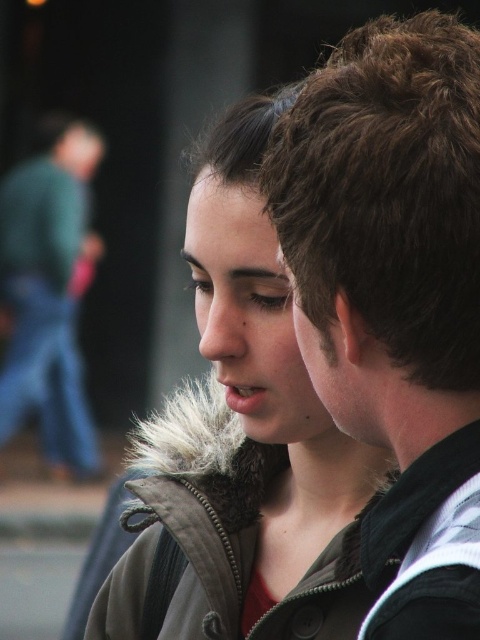
Question: Does brown hair at upper right appear on the right side of green denim jeans at left?

Choices:
 (A) yes
 (B) no

Answer: (A)

Question: Which point is farther to the camera?

Choices:
 (A) green denim jeans at left
 (B) brown hair at upper right

Answer: (A)

Question: Estimate the real-world distances between objects in this image. Which object is farther from the gray fur-lined jacket at center?

Choices:
 (A) green denim jeans at left
 (B) brown hair at upper right

Answer: (A)

Question: Does gray fur-lined jacket at center lie in front of green denim jeans at left?

Choices:
 (A) yes
 (B) no

Answer: (A)

Question: From the image, what is the correct spatial relationship of gray fur-lined jacket at center in relation to green denim jeans at left?

Choices:
 (A) left
 (B) right

Answer: (B)

Question: Which of the following is the farthest from the observer?

Choices:
 (A) green denim jeans at left
 (B) brown hair at upper right

Answer: (A)